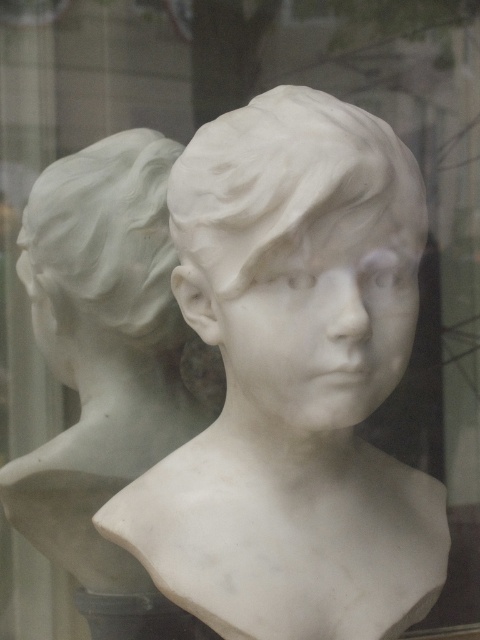
Can you confirm if white marble bust at left is positioned above white marble bust at center?

Incorrect, white marble bust at left is not positioned above white marble bust at center.

Between white marble bust at left and white marble bust at center, which one is positioned lower?

white marble bust at left is below.

You are a GUI agent. You are given a task and a screenshot of the screen. Output one action in this format:
    pyautogui.click(x=<x>, y=<y>)
    Task: Click on the white marble bust at left
    The image size is (480, 640).
    Given the screenshot: What is the action you would take?
    pyautogui.click(x=101, y=348)

Where is `white marble bust at left`? white marble bust at left is located at coordinates (101, 348).

Who is more forward, (79, 259) or (87, 228)?

Point (87, 228) is more forward.

From the picture: Is white marble bust at left taller than white marble head at left?

Yes.

What do you see at coordinates (101, 348) in the screenshot? I see `white marble bust at left` at bounding box center [101, 348].

Find the location of a particular element. white marble bust at left is located at coordinates (101, 348).

Can you confirm if white marble bust at center is positioned to the left of white marble head at left?

In fact, white marble bust at center is to the right of white marble head at left.

Does point (241, 163) come farther from viewer compared to point (142, 147)?

No, it is in front of (142, 147).

At what (x,y) coordinates should I click in order to perform the action: click on white marble bust at center. Please return your answer as a coordinate pair (x, y). This screenshot has height=640, width=480. Looking at the image, I should click on (292, 188).